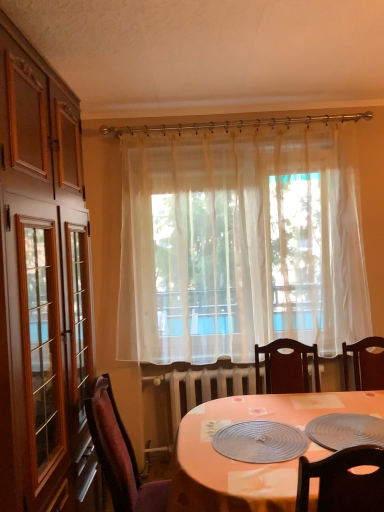
Question: Is metallic textured platter at center, the 1th platter when ordered from left to right, taller than metallic silver platter at lower right, the 2th platter from the left?

Choices:
 (A) no
 (B) yes

Answer: (A)

Question: From the image's perspective, is metallic textured platter at center, the 1th platter when ordered from left to right, located above metallic silver platter at lower right, which is the 1th platter in right-to-left order?

Choices:
 (A) yes
 (B) no

Answer: (B)

Question: Does metallic textured platter at center, the 1th platter when ordered from left to right, have a greater width compared to metallic silver platter at lower right, which is the 1th platter in right-to-left order?

Choices:
 (A) yes
 (B) no

Answer: (B)

Question: Is the depth of metallic textured platter at center, the 1th platter when ordered from left to right, less than that of metallic silver platter at lower right, the 2th platter from the left?

Choices:
 (A) no
 (B) yes

Answer: (A)

Question: Is metallic textured platter at center, which is the 2th platter from right to left, not inside metallic silver platter at lower right, the 2th platter from the left?

Choices:
 (A) yes
 (B) no

Answer: (A)

Question: Considering their positions, is metallic silver platter at lower right, the 2th platter from the left, located in front of or behind velvet burgundy chair at lower left?

Choices:
 (A) front
 (B) behind

Answer: (A)

Question: From the image's perspective, relative to velvet burgundy chair at lower left, is metallic silver platter at lower right, which is the 1th platter in right-to-left order, above or below?

Choices:
 (A) below
 (B) above

Answer: (B)

Question: Based on their positions, is metallic silver platter at lower right, the 2th platter from the left, located to the left or right of velvet burgundy chair at lower left?

Choices:
 (A) left
 (B) right

Answer: (B)

Question: In terms of height, does metallic silver platter at lower right, which is the 1th platter in right-to-left order, look taller or shorter compared to velvet burgundy chair at lower left?

Choices:
 (A) tall
 (B) short

Answer: (B)

Question: From a real-world perspective, relative to metallic silver platter at lower right, which is the 1th platter in right-to-left order, is sheer white curtain at center vertically above or below?

Choices:
 (A) below
 (B) above

Answer: (B)

Question: In terms of height, does sheer white curtain at center look taller or shorter compared to metallic silver platter at lower right, which is the 1th platter in right-to-left order?

Choices:
 (A) tall
 (B) short

Answer: (A)

Question: From the image's perspective, relative to metallic silver platter at lower right, which is the 1th platter in right-to-left order, is sheer white curtain at center above or below?

Choices:
 (A) above
 (B) below

Answer: (A)

Question: Does point (311, 202) appear closer or farther from the camera than point (319, 416)?

Choices:
 (A) closer
 (B) farther

Answer: (B)

Question: From a real-world perspective, is metallic silver platter at lower right, which is the 1th platter in right-to-left order, positioned above or below metallic textured platter at center, the 1th platter when ordered from left to right?

Choices:
 (A) above
 (B) below

Answer: (B)

Question: Considering the positions of metallic silver platter at lower right, the 2th platter from the left, and metallic textured platter at center, the 1th platter when ordered from left to right, in the image, is metallic silver platter at lower right, the 2th platter from the left, wider or thinner than metallic textured platter at center, the 1th platter when ordered from left to right,?

Choices:
 (A) wide
 (B) thin

Answer: (A)